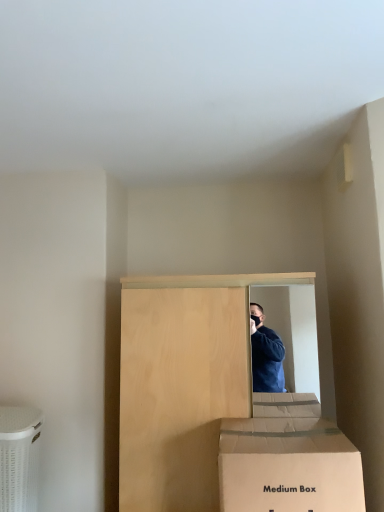
Find the location of a particular element. white cardboard box at lower center is located at coordinates point(288,466).

The height and width of the screenshot is (512, 384). Describe the element at coordinates (190, 380) in the screenshot. I see `bare wood cabinet at center` at that location.

The image size is (384, 512). Find the location of `cardboard box at lower left`. cardboard box at lower left is located at coordinates (19, 457).

Locate an element on the screen. The image size is (384, 512). white cardboard box at lower center is located at coordinates (288, 466).

Between white cardboard box at lower center and cardboard box at lower left, which one is positioned in front?

white cardboard box at lower center.

From a real-world perspective, which is physically below, white cardboard box at lower center or cardboard box at lower left?

From a 3D spatial view, cardboard box at lower left is below.

Between white cardboard box at lower center and cardboard box at lower left, which one has larger width?

white cardboard box at lower center is wider.

Does white cardboard box at lower center have a larger size compared to cardboard box at lower left?

Yes, white cardboard box at lower center is bigger than cardboard box at lower left.

At what (x,y) coordinates should I click in order to perform the action: click on box that appears on the right of bare wood cabinet at center. Please return your answer as a coordinate pair (x, y). The height and width of the screenshot is (512, 384). Looking at the image, I should click on (288, 466).

Does bare wood cabinet at center turn towards white cardboard box at lower center?

Yes, bare wood cabinet at center faces towards white cardboard box at lower center.

Is bare wood cabinet at center thinner than white cardboard box at lower center?

No.

Considering the relative positions of bare wood cabinet at center and white cardboard box at lower center in the image provided, is bare wood cabinet at center to the left of white cardboard box at lower center from the viewer's perspective?

Yes, bare wood cabinet at center is to the left of white cardboard box at lower center.

Looking at this image, in the image, is bare wood cabinet at center positioned in front of or behind cardboard box at lower left?

In the image, bare wood cabinet at center appears in front of cardboard box at lower left.

Where is `furniture on the right of cardboard box at lower left`? The image size is (384, 512). furniture on the right of cardboard box at lower left is located at coordinates (190, 380).

Is bare wood cabinet at center wider or thinner than cardboard box at lower left?

In the image, bare wood cabinet at center appears to be wider than cardboard box at lower left.

Looking at this image, between white cardboard box at lower center and bare wood cabinet at center, which one has more height?

bare wood cabinet at center.

Could you tell me if white cardboard box at lower center is facing bare wood cabinet at center?

No.

How different are the orientations of white cardboard box at lower center and bare wood cabinet at center in degrees?

2.01 degrees separate the facing orientations of white cardboard box at lower center and bare wood cabinet at center.

From a real-world perspective, between cardboard box at lower left and bare wood cabinet at center, who is vertically higher?

In real-world perspective, bare wood cabinet at center is above.

Would you say cardboard box at lower left contains bare wood cabinet at center?

That's incorrect, bare wood cabinet at center is not inside cardboard box at lower left.

Which object is further away from the camera taking this photo, cardboard box at lower left or bare wood cabinet at center?

cardboard box at lower left is behind.

Considering the sizes of objects cardboard box at lower left and bare wood cabinet at center in the image provided, who is thinner, cardboard box at lower left or bare wood cabinet at center?

With smaller width is cardboard box at lower left.

Is cardboard box at lower left oriented away from white cardboard box at lower center?

No.

Is cardboard box at lower left in front of or behind white cardboard box at lower center in the image?

Clearly, cardboard box at lower left is behind white cardboard box at lower center.

Considering the sizes of cardboard box at lower left and white cardboard box at lower center in the image, is cardboard box at lower left bigger or smaller than white cardboard box at lower center?

In the image, cardboard box at lower left appears to be smaller than white cardboard box at lower center.

In order to click on cardboard box located behind the white cardboard box at lower center in this screenshot , I will do `click(19, 457)`.

Find the location of a particular element. Image resolution: width=384 pixels, height=512 pixels. box that appears below the bare wood cabinet at center (from the image's perspective) is located at coordinates (288, 466).

When comparing their distances from white cardboard box at lower center, does bare wood cabinet at center or cardboard box at lower left seem closer?

bare wood cabinet at center is closer to white cardboard box at lower center.

Which object lies further to the anchor point cardboard box at lower left, white cardboard box at lower center or bare wood cabinet at center?

The object further to cardboard box at lower left is white cardboard box at lower center.

From the image, which object appears to be nearer to bare wood cabinet at center, white cardboard box at lower center or cardboard box at lower left?

Based on the image, white cardboard box at lower center appears to be nearer to bare wood cabinet at center.

Looking at the image, which one is located closer to white cardboard box at lower center, cardboard box at lower left or bare wood cabinet at center?

The object closer to white cardboard box at lower center is bare wood cabinet at center.

Estimate the real-world distances between objects in this image. Which object is closer to bare wood cabinet at center, cardboard box at lower left or white cardboard box at lower center?

Among the two, white cardboard box at lower center is located nearer to bare wood cabinet at center.

Looking at the image, which one is located further to cardboard box at lower left, bare wood cabinet at center or white cardboard box at lower center?

The object further to cardboard box at lower left is white cardboard box at lower center.

Where is `furniture between cardboard box at lower left and white cardboard box at lower center`? This screenshot has width=384, height=512. furniture between cardboard box at lower left and white cardboard box at lower center is located at coordinates (190, 380).